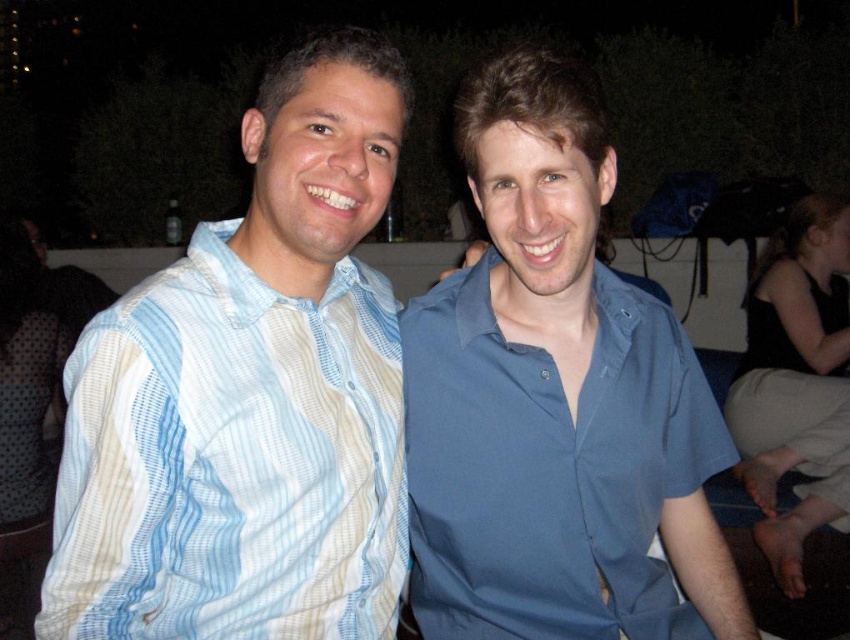
Which is more to the right, blue cotton shirt at center or black fabric at lower right?

From the viewer's perspective, black fabric at lower right appears more on the right side.

In the scene shown: Does blue cotton shirt at center have a larger size compared to black fabric at lower right?

Incorrect, blue cotton shirt at center is not larger than black fabric at lower right.

Where is `blue cotton shirt at center`? blue cotton shirt at center is located at coordinates (554, 401).

Locate an element on the screen. Image resolution: width=850 pixels, height=640 pixels. blue cotton shirt at center is located at coordinates (554, 401).

The image size is (850, 640). Describe the element at coordinates (554, 401) in the screenshot. I see `blue cotton shirt at center` at that location.

Does blue cotton shirt at center have a lesser width compared to blue striped shirt at left?

In fact, blue cotton shirt at center might be wider than blue striped shirt at left.

Is point (460, 336) closer to viewer compared to point (230, 620)?

No, it is not.

I want to click on blue cotton shirt at center, so click(x=554, y=401).

Does blue striped shirt at left appear under black fabric at lower right?

No.

Does blue striped shirt at left appear on the left side of black fabric at lower right?

Indeed, blue striped shirt at left is positioned on the left side of black fabric at lower right.

I want to click on blue striped shirt at left, so click(x=231, y=460).

Find the location of a particular element. This screenshot has height=640, width=850. blue striped shirt at left is located at coordinates (231, 460).